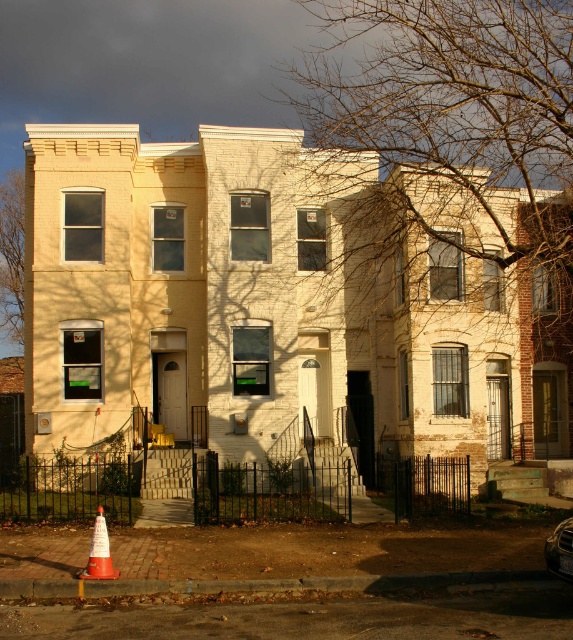
What do you see at coordinates (99, 552) in the screenshot? This screenshot has width=573, height=640. I see `orange matte traffic cone at lower left` at bounding box center [99, 552].

Is orange matte traffic cone at lower left positioned in front of shiny silver car at center?

No, it is behind shiny silver car at center.

Describe the element at coordinates (99, 552) in the screenshot. I see `orange matte traffic cone at lower left` at that location.

In order to click on orange matte traffic cone at lower left in this screenshot , I will do `click(99, 552)`.